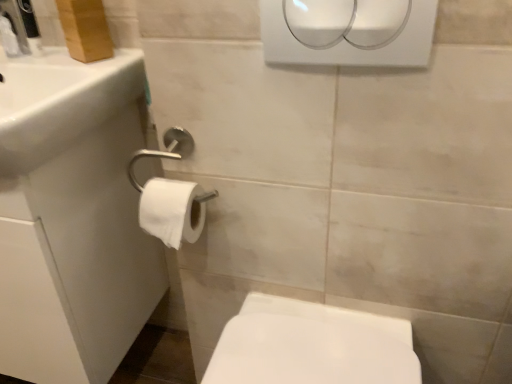
Question: Visually, is white glossy sink at upper left positioned to the left or to the right of white matte toilet paper at lower left?

Choices:
 (A) right
 (B) left

Answer: (B)

Question: Looking at the image, does white glossy sink at upper left seem bigger or smaller compared to white matte toilet paper at lower left?

Choices:
 (A) big
 (B) small

Answer: (A)

Question: Estimate the real-world distances between objects in this image. Which object is closer to the white matte toilet paper at lower left?

Choices:
 (A) white glossy sink at upper left
 (B) white glossy bidet at lower right
 (C) white glossy sink at left
 (D) white plastic hand dryer at upper center

Answer: (A)

Question: Which is nearer to the white glossy sink at left?

Choices:
 (A) white matte toilet paper at lower left
 (B) white plastic hand dryer at upper center
 (C) white glossy bidet at lower right
 (D) white glossy sink at upper left

Answer: (D)